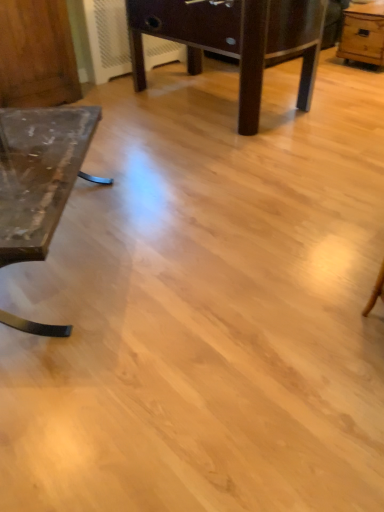
Identify the location of empty space that is ontop of matte glass table at left, acting as the first table starting from the left (from a real-world perspective). (30, 159).